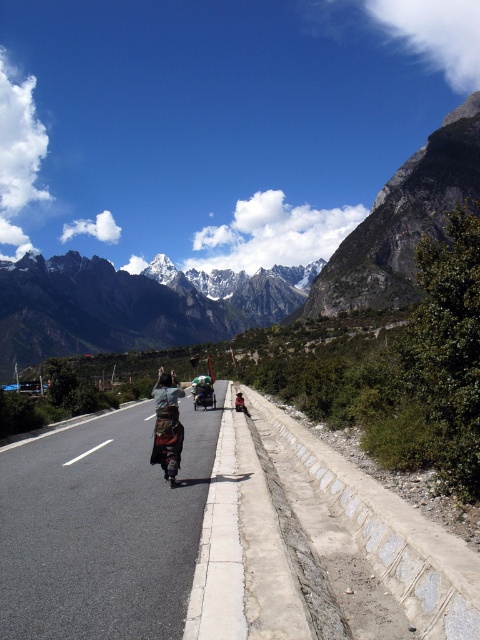
Question: Estimate the real-world distances between objects in this image. Which object is farther from the black asphalt road at center?

Choices:
 (A) green matte motorcycle at center
 (B) white rocky mountain range at upper center

Answer: (B)

Question: Which point is closer to the camera?

Choices:
 (A) black asphalt road at center
 (B) smooth concrete path at center

Answer: (A)

Question: Is black asphalt road at center above green matte motorcycle at center?

Choices:
 (A) yes
 (B) no

Answer: (B)

Question: Can you confirm if smooth concrete path at center is positioned above camouflage fabric backpack at center?

Choices:
 (A) no
 (B) yes

Answer: (A)

Question: Which of the following is the farthest from the observer?

Choices:
 (A) (32, 305)
 (B) (215, 403)
 (C) (175, 392)
 (D) (173, 429)

Answer: (A)

Question: Is black asphalt road at center to the right of camouflage fabric backpack at center from the viewer's perspective?

Choices:
 (A) no
 (B) yes

Answer: (A)